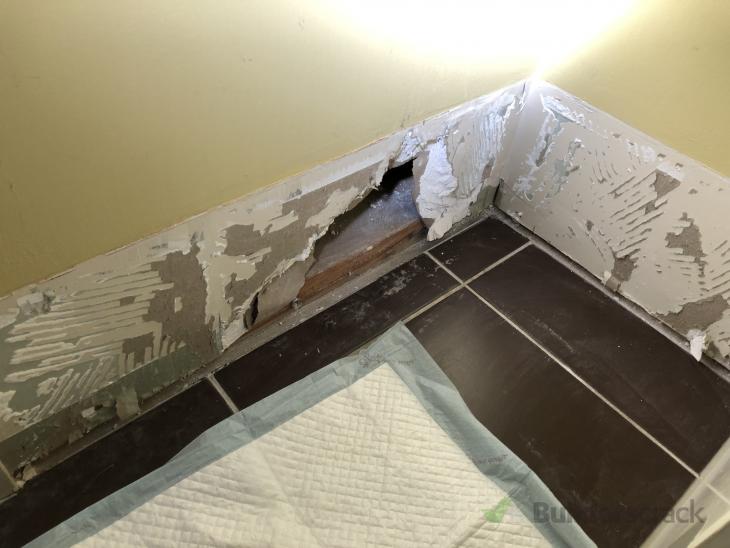
You are a GUI agent. You are given a task and a screenshot of the screen. Output one action in this format:
    pyautogui.click(x=<x>, y=<y>)
    Task: Click on the floor tile
    
    Given the screenshot: What is the action you would take?
    pyautogui.click(x=514, y=415), pyautogui.click(x=107, y=475), pyautogui.click(x=288, y=353), pyautogui.click(x=474, y=243), pyautogui.click(x=379, y=321), pyautogui.click(x=630, y=342)